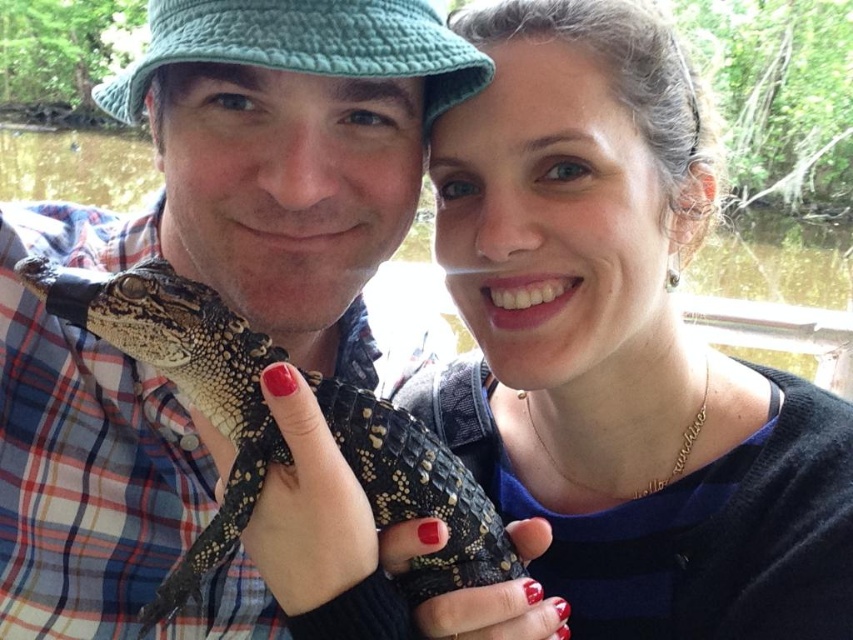
Is matte black reptile at center shorter than slick black reptile at center?

Yes.

Who is taller, matte black reptile at center or slick black reptile at center?

slick black reptile at center is taller.

Which is behind, point (579, 371) or point (114, 451)?

Positioned behind is point (114, 451).

Locate an element on the screen. matte black reptile at center is located at coordinates (618, 355).